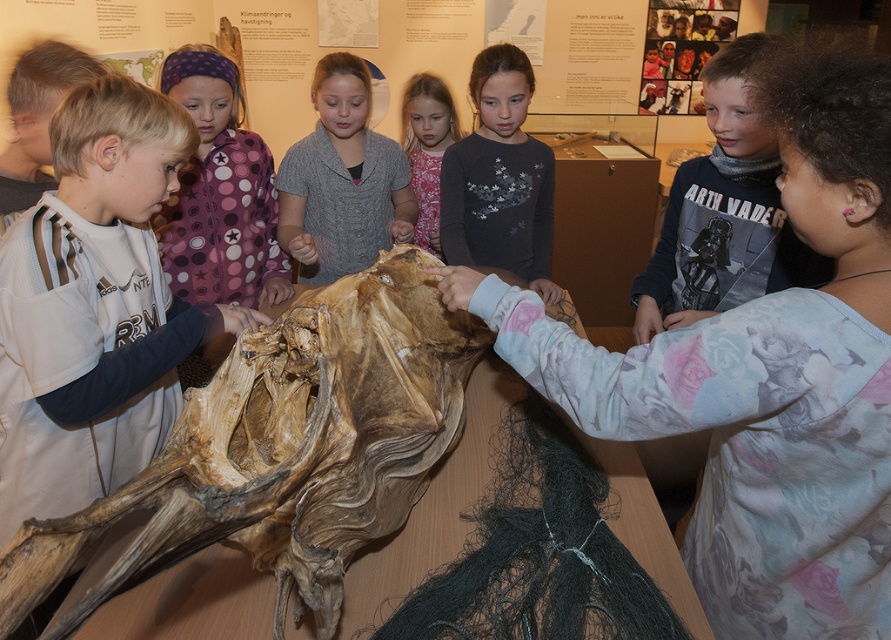
Question: Which object is positioned farthest from the purple dotted shirt at upper left?

Choices:
 (A) matte white shirt at left
 (B) gray matte sweater at center
 (C) dark gray fabric shirt at center
 (D) dark gray cotton shirt at center

Answer: (D)

Question: Does matte brown skull at center appear over gray matte sweater at center?

Choices:
 (A) no
 (B) yes

Answer: (A)

Question: Does dark gray fabric shirt at center lie in front of pink floral dress at center?

Choices:
 (A) yes
 (B) no

Answer: (A)

Question: Can you confirm if purple dotted shirt at upper left is thinner than gray matte sweater at center?

Choices:
 (A) yes
 (B) no

Answer: (A)

Question: Which point is farther from the camera taking this photo?

Choices:
 (A) (205, 166)
 (B) (324, 141)

Answer: (B)

Question: Among these points, which one is nearest to the camera?

Choices:
 (A) (373, 209)
 (B) (448, 108)
 (C) (233, 122)
 (D) (722, 109)

Answer: (D)